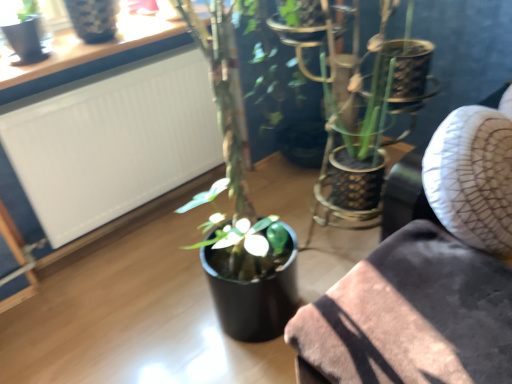
Find the location of a particular element. matte black pot at center is located at coordinates (428, 277).

The width and height of the screenshot is (512, 384). What do you see at coordinates (428, 277) in the screenshot?
I see `matte black pot at center` at bounding box center [428, 277].

Find the location of a particular element. Image resolution: width=512 pixels, height=384 pixels. matte black pot at center is located at coordinates (428, 277).